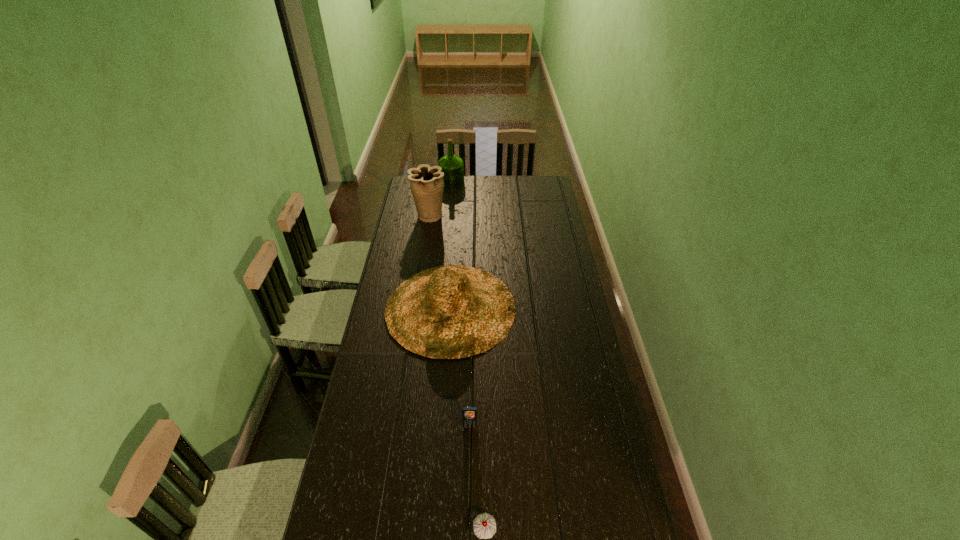
Identify the location of urn located at the left edge. Image resolution: width=960 pixels, height=540 pixels. (426, 183).

Identify the location of sunhat located at the left edge. The width and height of the screenshot is (960, 540). (451, 311).

Image resolution: width=960 pixels, height=540 pixels. In the image, there is a desktop. Find the location of `vacant space at the far edge`. vacant space at the far edge is located at coordinates (478, 186).

Where is `vacant space at the left edge of the desktop`? This screenshot has height=540, width=960. vacant space at the left edge of the desktop is located at coordinates (425, 235).

Identify the location of free space at the right edge of the desktop. (550, 231).

Identify the location of free location at the far right corner. (541, 184).

Locate which object is the second closest to the second nearest object. Please provide its 2D coordinates. Your answer should be formatted as a tuple, i.e. [(x, y)], where the tuple contains the x and y coordinates of a point satisfying the conditions above.

[(484, 525)]

Select which object appears as the third closest to the urn. Please provide its 2D coordinates. Your answer should be formatted as a tuple, i.e. [(x, y)], where the tuple contains the x and y coordinates of a point satisfying the conditions above.

[(469, 414)]

I want to click on free space that satisfies the following two spatial constraints: 1. on the front side of the farthest object; 2. on the left side of the third farthest object, so click(x=440, y=308).